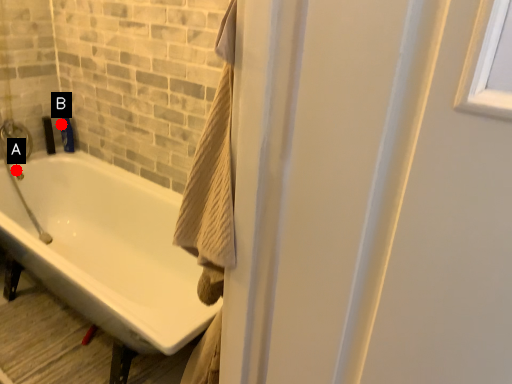
Question: Two points are circled on the image, labeled by A and B beside each circle. Among these points, which one is nearest to the camera?

Choices:
 (A) A is closer
 (B) B is closer

Answer: (A)